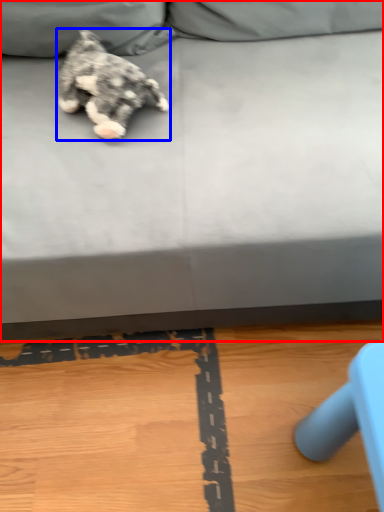
Question: Which point is closer to the camera, studio couch (highlighted by a red box) or dog (highlighted by a blue box)?

Choices:
 (A) studio couch
 (B) dog

Answer: (A)